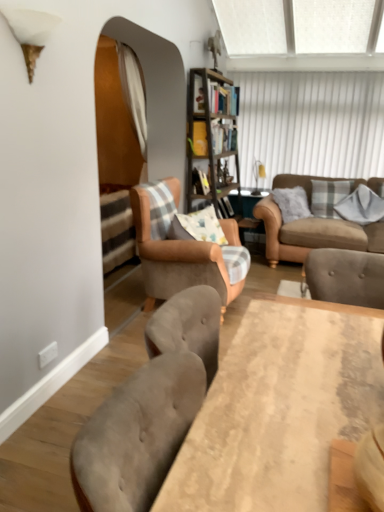
Question: Is white textured window screen at upper center behind wooden table at center?

Choices:
 (A) yes
 (B) no

Answer: (A)

Question: Is white textured window screen at upper center beside wooden table at center?

Choices:
 (A) no
 (B) yes

Answer: (A)

Question: Is wooden table at center at the back of white textured window screen at upper center?

Choices:
 (A) no
 (B) yes

Answer: (A)

Question: Does white textured window screen at upper center have a greater width compared to wooden table at center?

Choices:
 (A) yes
 (B) no

Answer: (B)

Question: From the image's perspective, would you say white textured window screen at upper center is positioned over wooden table at center?

Choices:
 (A) yes
 (B) no

Answer: (A)

Question: Considering the relative positions of white textured window screen at upper center and white fabric curtain at center in the image provided, is white textured window screen at upper center to the left or to the right of white fabric curtain at center?

Choices:
 (A) left
 (B) right

Answer: (B)

Question: In terms of width, does white textured window screen at upper center look wider or thinner when compared to white fabric curtain at center?

Choices:
 (A) thin
 (B) wide

Answer: (A)

Question: From the image's perspective, relative to white fabric curtain at center, is white textured window screen at upper center above or below?

Choices:
 (A) below
 (B) above

Answer: (B)

Question: Is white textured window screen at upper center taller or shorter than white fabric curtain at center?

Choices:
 (A) tall
 (B) short

Answer: (A)

Question: Is light brown fabric armchair at center bigger or smaller than white fabric curtain at center?

Choices:
 (A) small
 (B) big

Answer: (B)

Question: Is point (215, 260) positioned closer to the camera than point (140, 95)?

Choices:
 (A) closer
 (B) farther

Answer: (A)

Question: From the image's perspective, relative to white fabric curtain at center, is light brown fabric armchair at center above or below?

Choices:
 (A) below
 (B) above

Answer: (A)

Question: Is light brown fabric armchair at center wider or thinner than white fabric curtain at center?

Choices:
 (A) wide
 (B) thin

Answer: (A)

Question: Considering the positions of light brown fabric armchair at center and wooden table at center in the image, is light brown fabric armchair at center taller or shorter than wooden table at center?

Choices:
 (A) short
 (B) tall

Answer: (B)

Question: Considering the positions of light brown fabric armchair at center and wooden table at center in the image, is light brown fabric armchair at center wider or thinner than wooden table at center?

Choices:
 (A) thin
 (B) wide

Answer: (B)